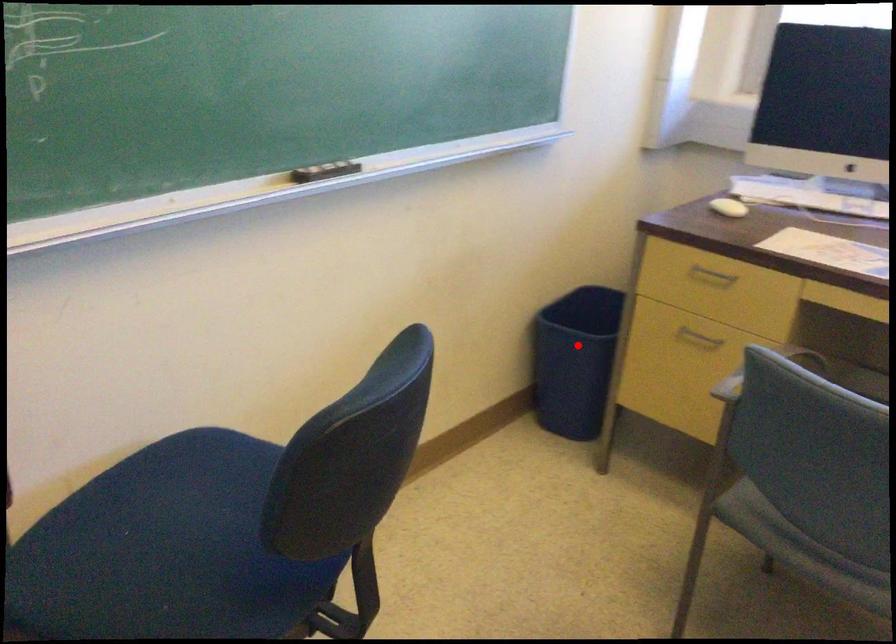
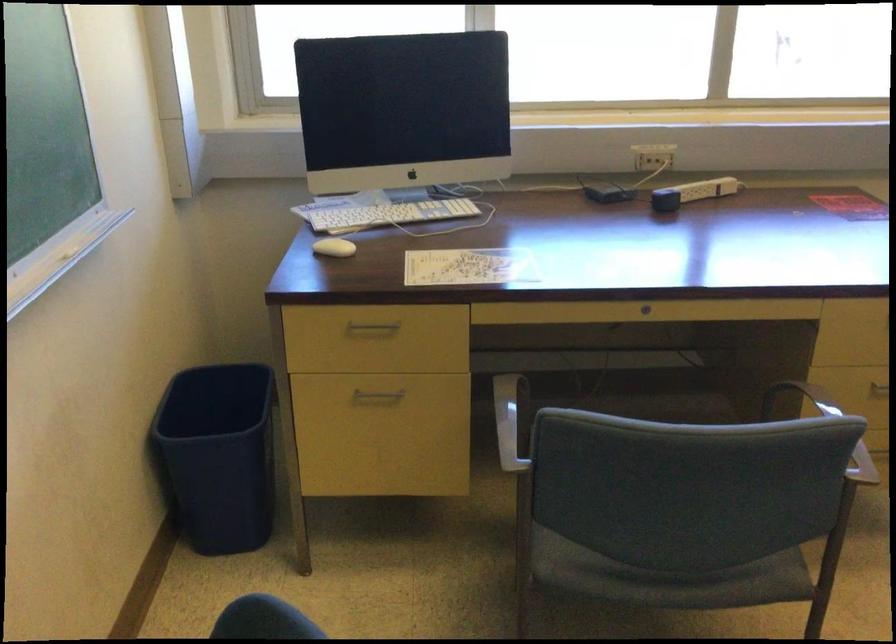
Question: I am providing you with two images of the same scene from different viewpoints. Given a red point in image1, look at the same physical point in image2. Is it:

Choices:
 (A) Closer to the viewpoint
 (B) Farther from the viewpoint

Answer: (A)